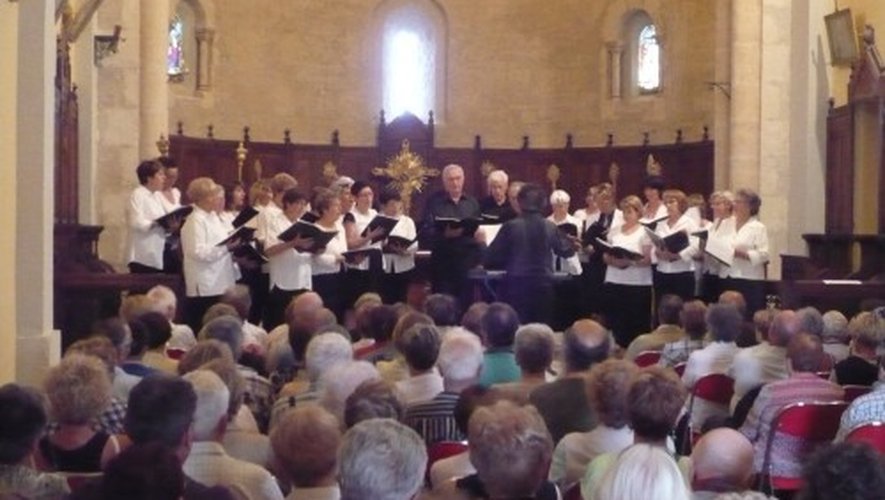
This screenshot has height=500, width=885. What are the coordinates of `carved chairs on altar` in the screenshot? It's located at (839, 204), (72, 198).